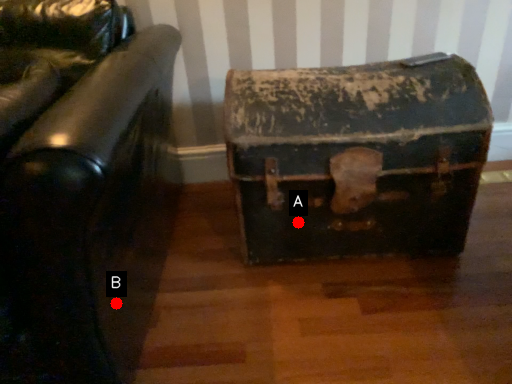
Question: Two points are circled on the image, labeled by A and B beside each circle. Which point is closer to the camera taking this photo?

Choices:
 (A) A is closer
 (B) B is closer

Answer: (B)